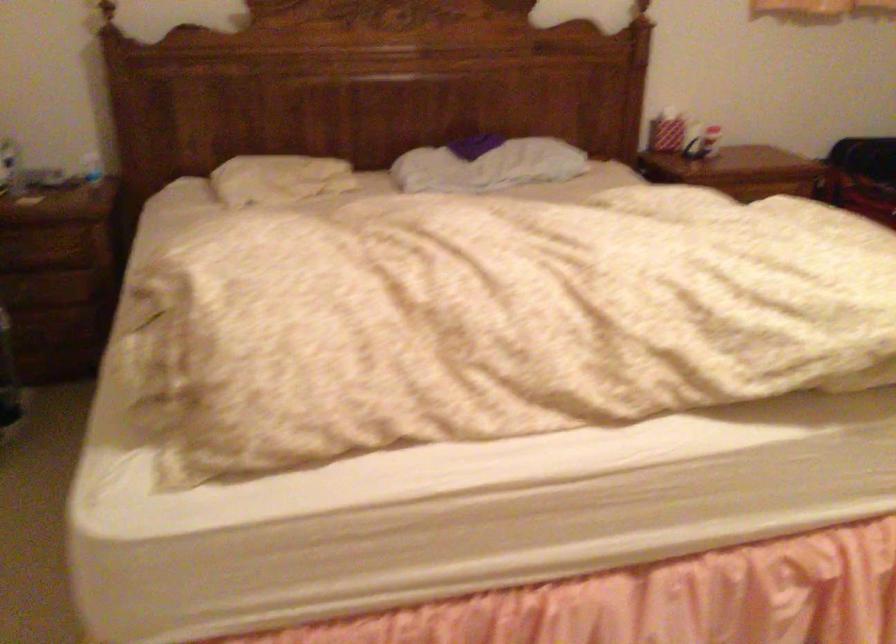
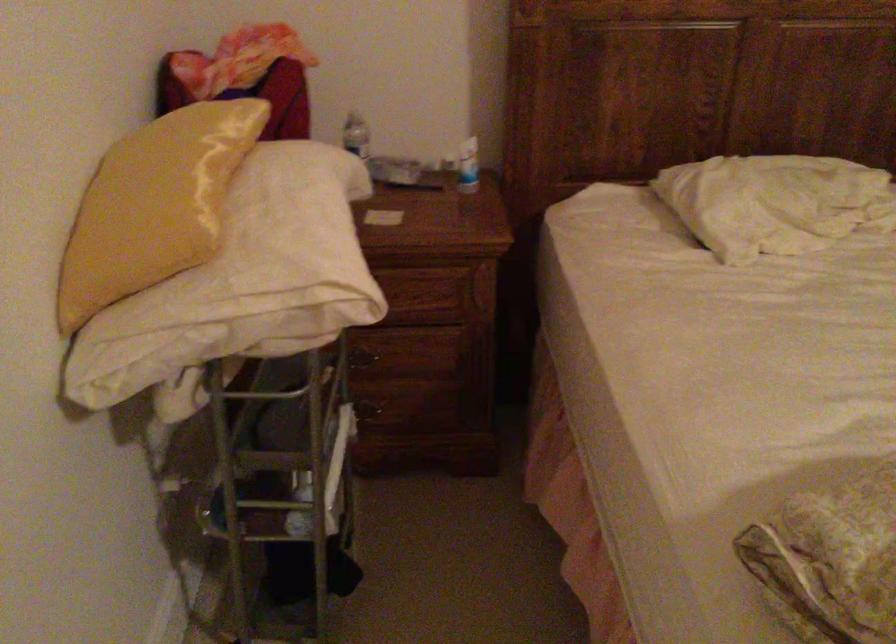
The point at [266,178] is marked in the first image. Where is the corresponding point in the second image?

(774, 202)